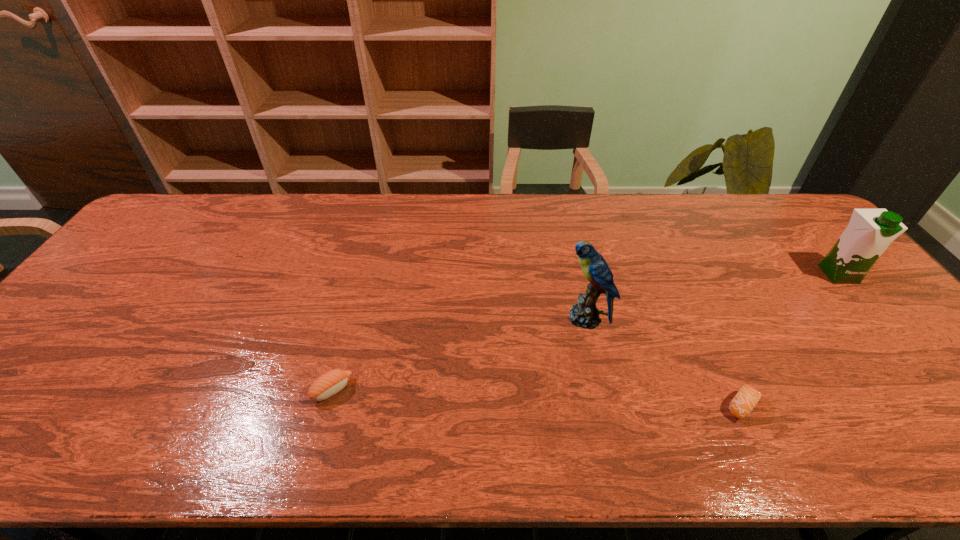
Identify the location of the closest object to the farthest object. (747, 397).

Where is `free space in the image that satisfies the following two spatial constraints: 1. on the front-facing side of the farthest object; 2. on the face of the parrot`? Image resolution: width=960 pixels, height=540 pixels. free space in the image that satisfies the following two spatial constraints: 1. on the front-facing side of the farthest object; 2. on the face of the parrot is located at coordinates (876, 318).

I want to click on free space that satisfies the following two spatial constraints: 1. on the back side of the third object from left to right; 2. on the face of the parrot, so click(x=701, y=318).

At what (x,y) coordinates should I click in order to perform the action: click on blank space that satisfies the following two spatial constraints: 1. on the front-facing side of the soya milk; 2. on the face of the second farthest object. Please return your answer as a coordinate pair (x, y). This screenshot has width=960, height=540. Looking at the image, I should click on (876, 318).

The width and height of the screenshot is (960, 540). I want to click on free space in the image that satisfies the following two spatial constraints: 1. on the front side of the taller sushi; 2. on the right side of the right sushi, so click(327, 406).

Locate an element on the screen. Image resolution: width=960 pixels, height=540 pixels. free space that satisfies the following two spatial constraints: 1. on the face of the shorter sushi; 2. on the left side of the third object from right to left is located at coordinates (606, 406).